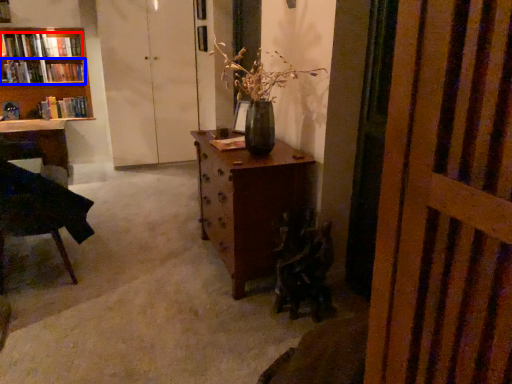
Question: Which object appears closest to the camera in this image, book (highlighted by a red box) or book (highlighted by a blue box)?

Choices:
 (A) book
 (B) book

Answer: (A)